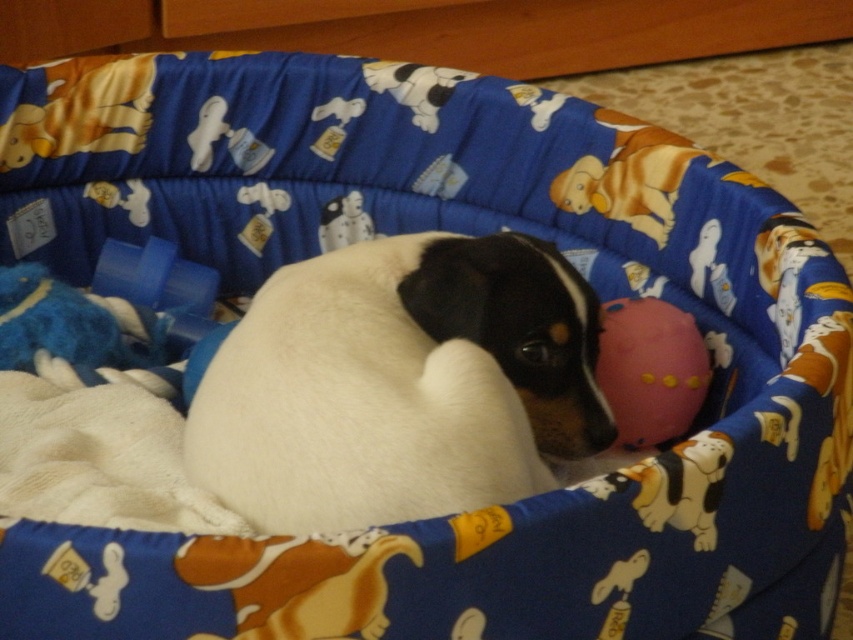
Is white fur dog at center further to camera compared to pink rubber ball at center?

That is False.

Does white fur dog at center have a greater height compared to pink rubber ball at center?

Correct, white fur dog at center is much taller as pink rubber ball at center.

Is point (244, 385) positioned after point (677, 385)?

No, it is not.

Locate an element on the screen. white fur dog at center is located at coordinates (399, 384).